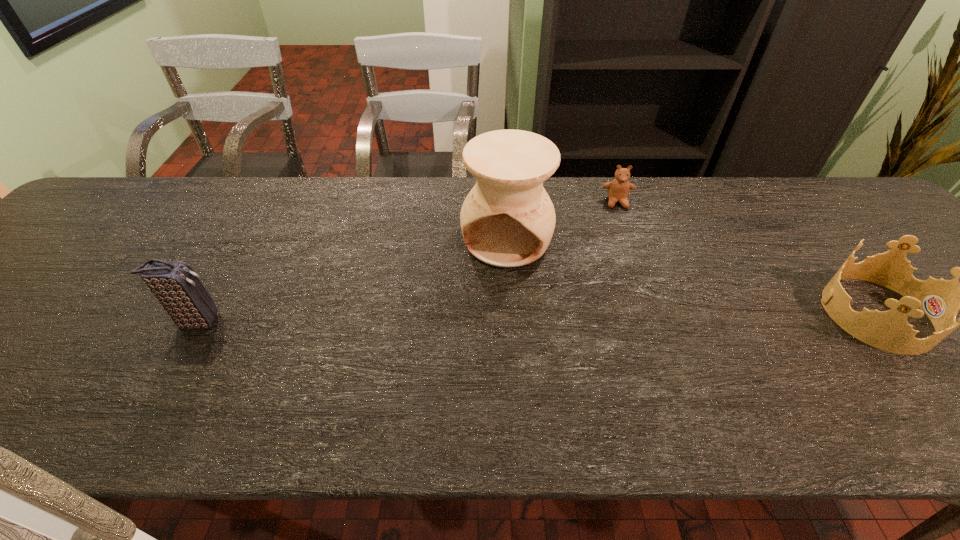
Image resolution: width=960 pixels, height=540 pixels. In order to click on vacant spot on the desktop that is between the second tallest object and the rightmost object and is positioned at the open side of the pottery in this screenshot , I will do `click(489, 318)`.

At what (x,y) coordinates should I click in order to perform the action: click on vacant spot on the desktop that is between the clutch bag and the second shortest object and is positioned on the face of the second object from right to left. Please return your answer as a coordinate pair (x, y). The height and width of the screenshot is (540, 960). Looking at the image, I should click on (640, 316).